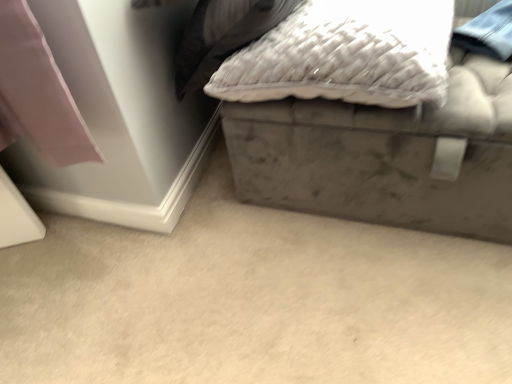
You are a GUI agent. You are given a task and a screenshot of the screen. Output one action in this format:
    pyautogui.click(x=<x>, y=<y>)
    Task: Click on the vacant region above gray matte storage box at lower right (from a real-world perspective)
    
    Given the screenshot: What is the action you would take?
    [232, 271]